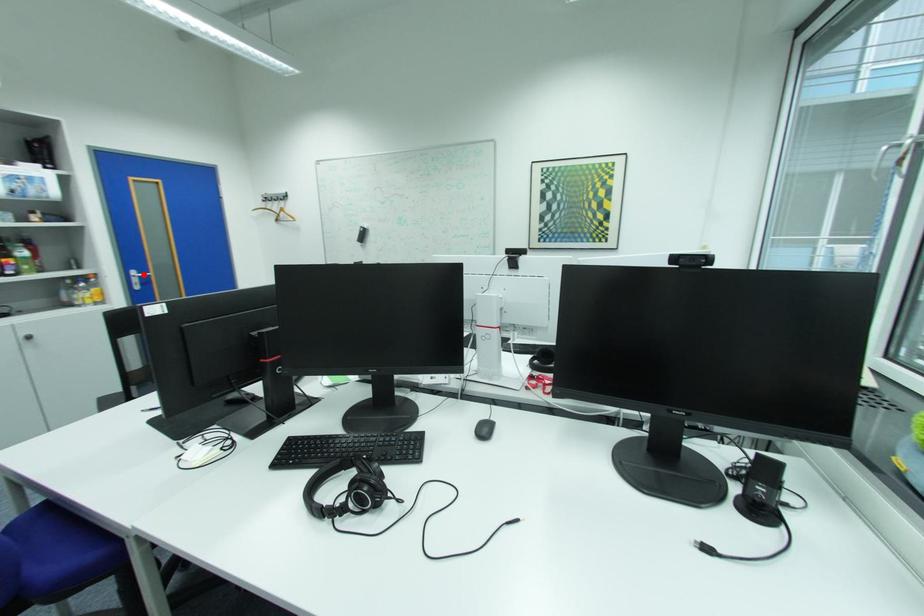
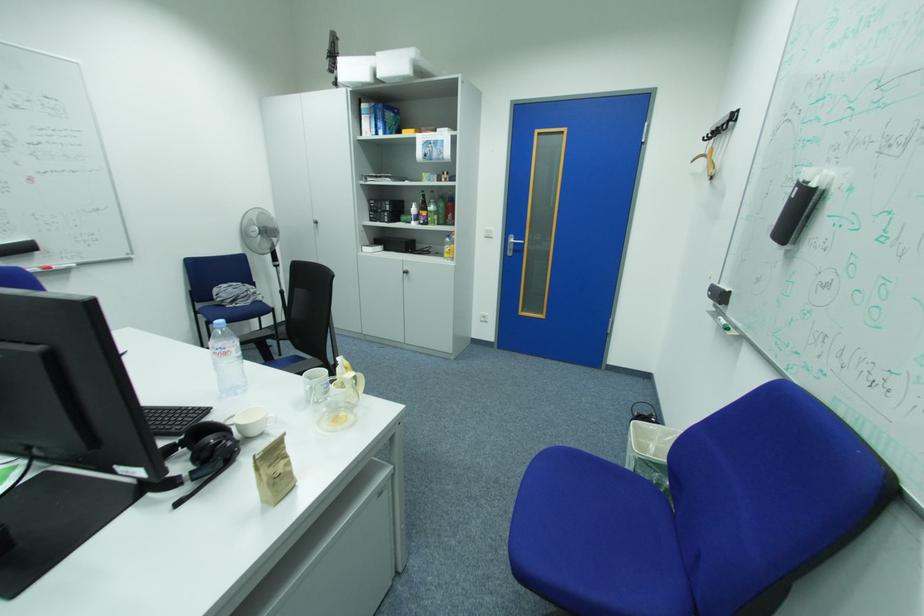
Question: I am providing you with two images of the same scene from different viewpoints. A red point is shown in image1. For the corresponding object point in image2, is it positioned nearer or farther from the camera?

Choices:
 (A) Nearer
 (B) Farther

Answer: (A)